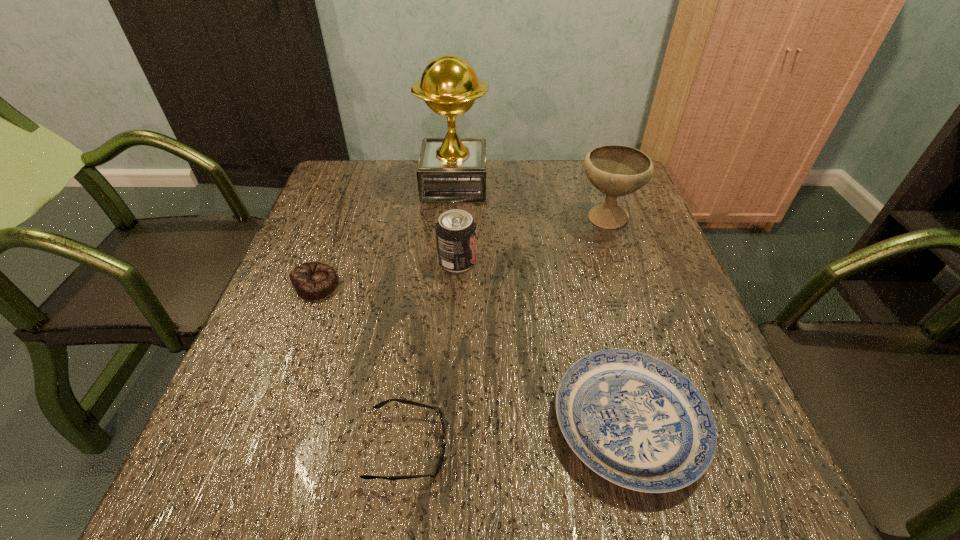
Where is `vacant space that satisfies the following two spatial constraints: 1. on the front side of the fourth shortest object; 2. on the lenses of the sunglasses`? This screenshot has height=540, width=960. vacant space that satisfies the following two spatial constraints: 1. on the front side of the fourth shortest object; 2. on the lenses of the sunglasses is located at coordinates (x=447, y=447).

This screenshot has width=960, height=540. In order to click on free point that satisfies the following two spatial constraints: 1. on the front-facing side of the award; 2. on the right side of the plate in this screenshot , I will do `click(436, 423)`.